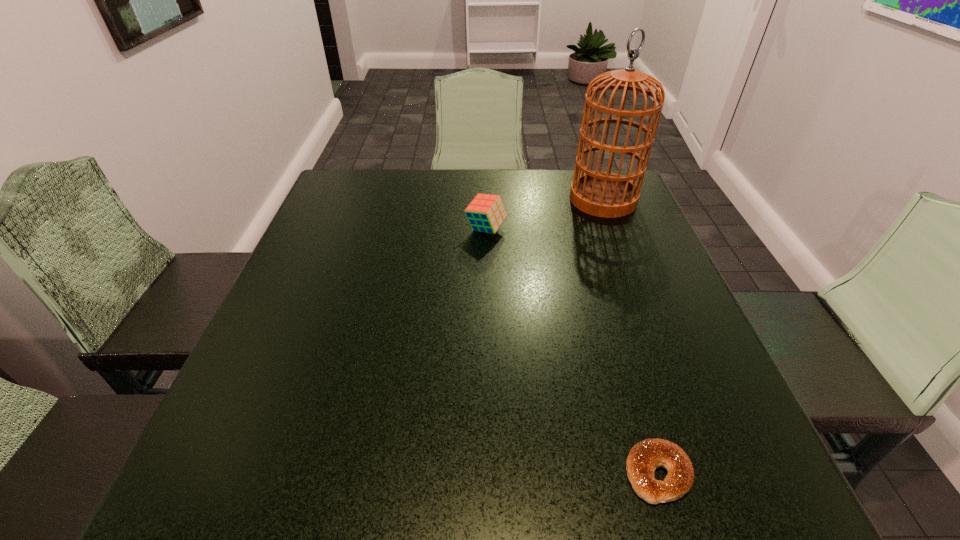
Image resolution: width=960 pixels, height=540 pixels. Find the location of `vacant area that lies between the leftmost object and the shortest object`. vacant area that lies between the leftmost object and the shortest object is located at coordinates (572, 351).

Identify the location of free spot between the tallest object and the leftmost object. (544, 214).

In order to click on free spot between the shortest object and the tallest object in this screenshot , I will do pyautogui.click(x=631, y=336).

Where is `unoccupied position between the shortest object and the tallest object`? unoccupied position between the shortest object and the tallest object is located at coordinates (631, 336).

The image size is (960, 540). What are the coordinates of `free space that is in between the nearest object and the birdcage` in the screenshot? It's located at (631, 336).

At what (x,y) coordinates should I click in order to perform the action: click on empty space that is in between the farthest object and the second farthest object. Please return your answer as a coordinate pair (x, y). This screenshot has width=960, height=540. Looking at the image, I should click on (544, 214).

Locate an element on the screen. unoccupied position between the cube and the farthest object is located at coordinates (544, 214).

In order to click on free space between the tallest object and the second tallest object in this screenshot , I will do `click(544, 214)`.

You are a GUI agent. You are given a task and a screenshot of the screen. Output one action in this format:
    pyautogui.click(x=<x>, y=<y>)
    Task: Click on the empty space that is in between the tallest object and the bagel
    This screenshot has width=960, height=540.
    Given the screenshot: What is the action you would take?
    pyautogui.click(x=631, y=336)

Find the location of a particular element. The height and width of the screenshot is (540, 960). vacant area that lies between the birdcage and the leftmost object is located at coordinates (544, 214).